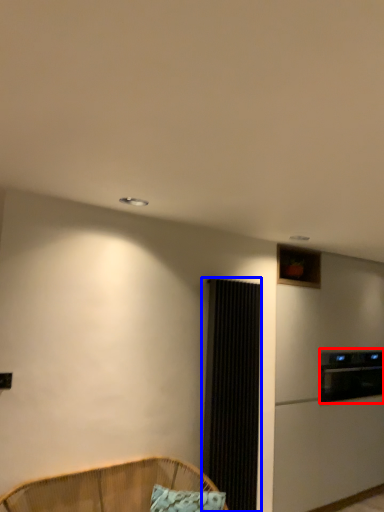
Question: Among these objects, which one is farthest to the camera, appliance (highlighted by a red box) or screen door (highlighted by a blue box)?

Choices:
 (A) appliance
 (B) screen door

Answer: (A)